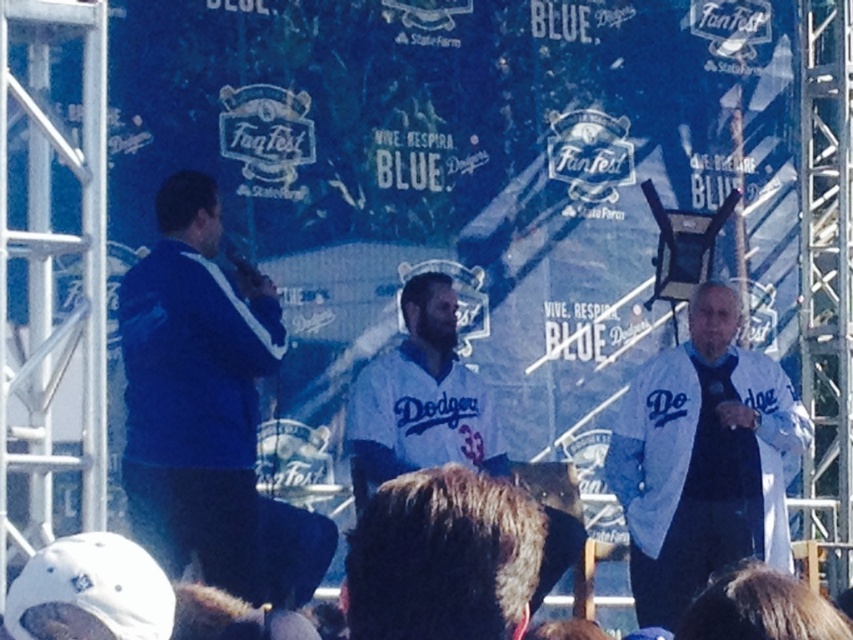
Question: Which object appears closest to the camera in this image?

Choices:
 (A) white fabric jacket at right
 (B) white jersey at center
 (C) blue fabric jacket at left

Answer: (C)

Question: Considering the relative positions of blue fabric jacket at left and white fabric jacket at right in the image provided, where is blue fabric jacket at left located with respect to white fabric jacket at right?

Choices:
 (A) left
 (B) right

Answer: (A)

Question: In this image, where is blue fabric jacket at left located relative to white fabric jacket at right?

Choices:
 (A) left
 (B) right

Answer: (A)

Question: Is brown fur at center further to camera compared to white jersey at center?

Choices:
 (A) yes
 (B) no

Answer: (B)

Question: Which of these objects is positioned farthest from the white fabric jacket at right?

Choices:
 (A) brown fur at center
 (B) white jersey at center
 (C) blue fabric jacket at left

Answer: (A)

Question: Which object is closer to the camera taking this photo?

Choices:
 (A) white jersey at center
 (B) blue fabric jacket at left
 (C) white fabric jacket at right

Answer: (B)